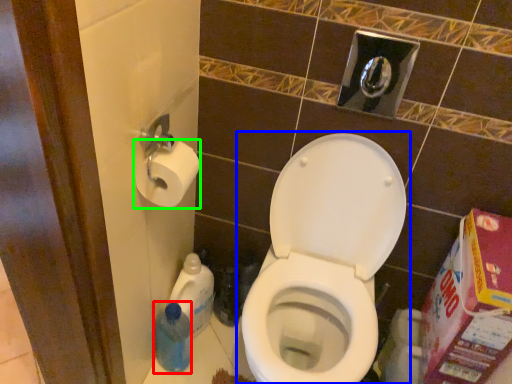
Question: Estimate the real-world distances between objects in this image. Which object is farther from cleaning product (highlighted by a red box), toilet (highlighted by a blue box) or toilet paper (highlighted by a green box)?

Choices:
 (A) toilet
 (B) toilet paper

Answer: (B)